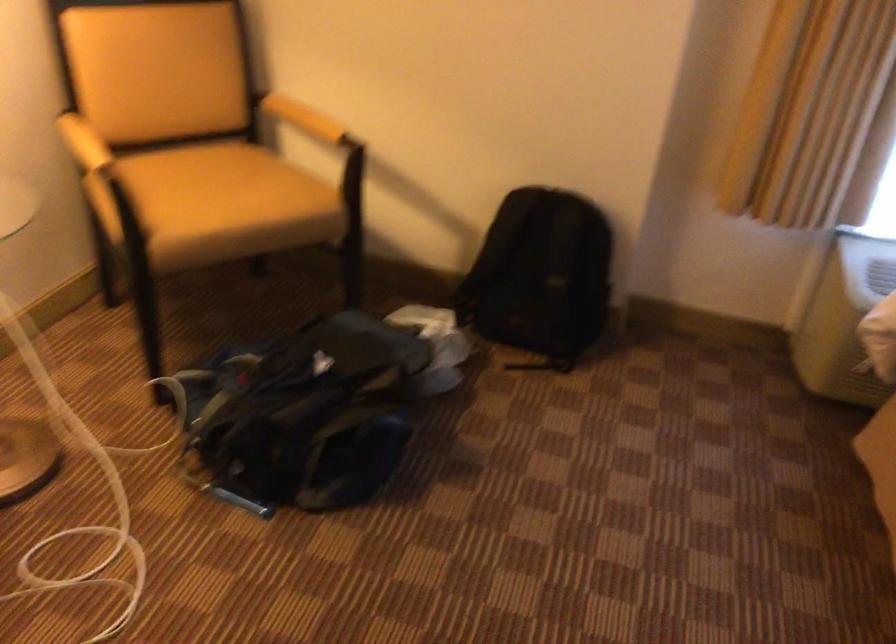
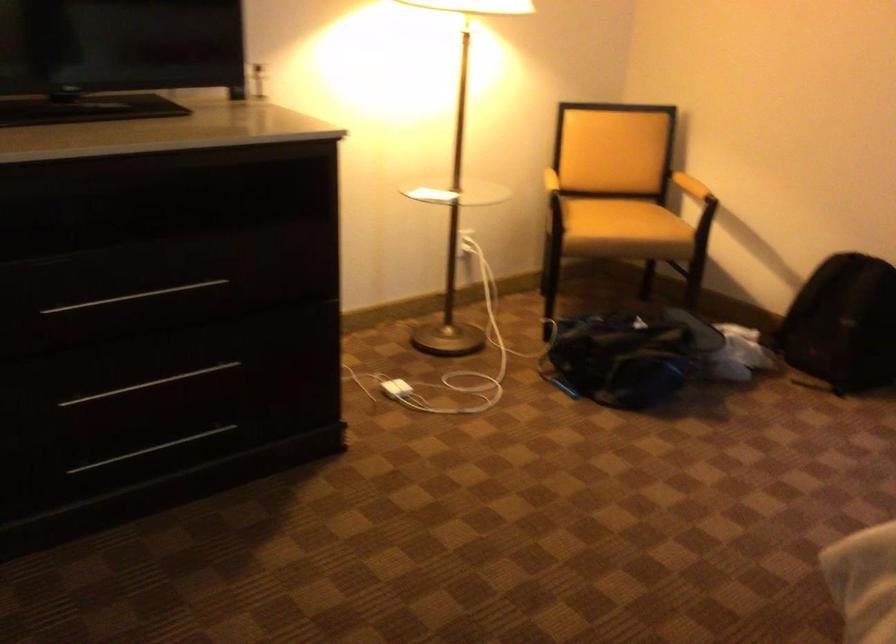
In the second image, find the point that corresponds to the point at 333,426 in the first image.

(627, 355)